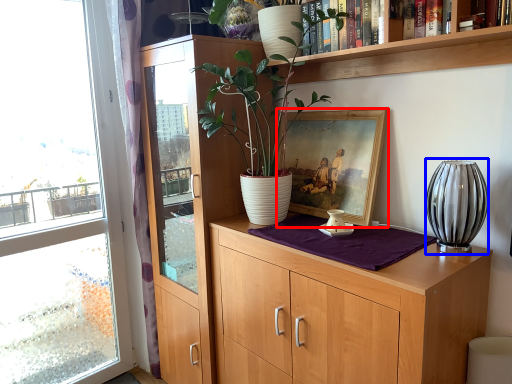
Question: Among these objects, which one is farthest to the camera, picture frame (highlighted by a red box) or vase (highlighted by a blue box)?

Choices:
 (A) picture frame
 (B) vase

Answer: (A)